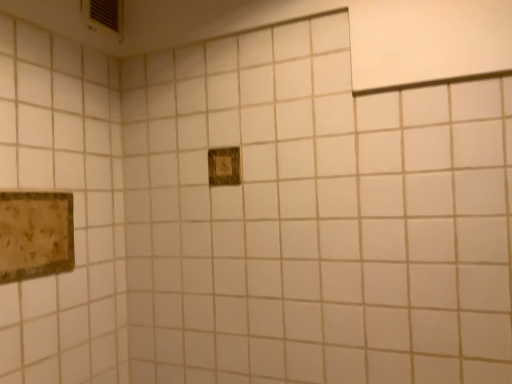
Measure the distance between point [27,258] and camera.

Point [27,258] is 1.01 meters away from camera.

Identify the location of rustic wood picture frame at lower left, which is the 1th picture frame in front-to-back order. (35, 235).

This screenshot has width=512, height=384. Describe the element at coordinates (35, 235) in the screenshot. I see `rustic wood picture frame at lower left, the second picture frame from the top` at that location.

This screenshot has width=512, height=384. Describe the element at coordinates (224, 166) in the screenshot. I see `wooden plaque at center, the second picture frame when ordered from bottom to top` at that location.

The width and height of the screenshot is (512, 384). I want to click on wooden plaque at center, the second picture frame when ordered from bottom to top, so click(224, 166).

Find the location of a particular element. The width and height of the screenshot is (512, 384). rustic wood picture frame at lower left, the second picture frame from the top is located at coordinates click(x=35, y=235).

Can you confirm if wooden plaque at center, the first picture frame when ordered from top to bottom, is positioned to the left of rustic wood picture frame at lower left, which is the 2th picture frame in right-to-left order?

No, wooden plaque at center, the first picture frame when ordered from top to bottom, is not to the left of rustic wood picture frame at lower left, which is the 2th picture frame in right-to-left order.

Is the depth of wooden plaque at center, placed as the 2th picture frame when sorted from front to back, greater than that of rustic wood picture frame at lower left, the second picture frame from the top?

Yes.

Which point is more distant from viewer, (228, 154) or (57, 199)?

The point (228, 154) is more distant.

From the image's perspective, is wooden plaque at center, which is the 1th picture frame from back to front, over rustic wood picture frame at lower left, the second picture frame from the top?

Yes.

From a real-world perspective, is wooden plaque at center, which is the first picture frame from right to left, under rustic wood picture frame at lower left, which is the 1th picture frame in front-to-back order?

Incorrect, from a real-world perspective, wooden plaque at center, which is the first picture frame from right to left, is higher than rustic wood picture frame at lower left, which is the 1th picture frame in front-to-back order.

Which object is thinner, wooden plaque at center, which is the 1th picture frame from back to front, or rustic wood picture frame at lower left, which appears as the first picture frame when ordered from the bottom?

Thinner between the two is wooden plaque at center, which is the 1th picture frame from back to front.

Is wooden plaque at center, which is the 1th picture frame from back to front, taller than rustic wood picture frame at lower left, acting as the second picture frame starting from the back?

No.

Who is bigger, wooden plaque at center, which appears as the second picture frame when viewed from the left, or rustic wood picture frame at lower left, acting as the second picture frame starting from the back?

rustic wood picture frame at lower left, acting as the second picture frame starting from the back, is bigger.

Can rustic wood picture frame at lower left, acting as the second picture frame starting from the back, be found inside wooden plaque at center, which is the 1th picture frame from back to front?

No, rustic wood picture frame at lower left, acting as the second picture frame starting from the back, is located outside of wooden plaque at center, which is the 1th picture frame from back to front.

Is wooden plaque at center, which is the 1th picture frame from back to front, not near rustic wood picture frame at lower left, which appears as the first picture frame when ordered from the bottom?

No, wooden plaque at center, which is the 1th picture frame from back to front, is not far from rustic wood picture frame at lower left, which appears as the first picture frame when ordered from the bottom.

Is wooden plaque at center, the second picture frame when ordered from bottom to top, looking in the opposite direction of rustic wood picture frame at lower left, which appears as the first picture frame when ordered from the bottom?

wooden plaque at center, the second picture frame when ordered from bottom to top, does not have its back to rustic wood picture frame at lower left, which appears as the first picture frame when ordered from the bottom.

I want to click on picture frame to the right of rustic wood picture frame at lower left, which appears as the first picture frame when ordered from the bottom, so click(x=224, y=166).

Consider the image. Can you confirm if rustic wood picture frame at lower left, which is the 1th picture frame in front-to-back order, is positioned to the right of wooden plaque at center, the first picture frame when ordered from top to bottom?

No, rustic wood picture frame at lower left, which is the 1th picture frame in front-to-back order, is not to the right of wooden plaque at center, the first picture frame when ordered from top to bottom.

Considering their positions, is rustic wood picture frame at lower left, which is the 2th picture frame in right-to-left order, located in front of or behind wooden plaque at center, the second picture frame when ordered from bottom to top?

Clearly, rustic wood picture frame at lower left, which is the 2th picture frame in right-to-left order, is in front of wooden plaque at center, the second picture frame when ordered from bottom to top.

Which is nearer, (28,205) or (237,163)?

Point (28,205) appears to be closer to the viewer than point (237,163).

In the scene shown: From the image's perspective, is rustic wood picture frame at lower left, which is the 2th picture frame in right-to-left order, under wooden plaque at center, the first picture frame when ordered from top to bottom?

Indeed, from the image's perspective, rustic wood picture frame at lower left, which is the 2th picture frame in right-to-left order, is shown beneath wooden plaque at center, the first picture frame when ordered from top to bottom.

Looking at this image, from a real-world perspective, is rustic wood picture frame at lower left, the second picture frame from the top, above or below wooden plaque at center, placed as the 2th picture frame when sorted from front to back?

rustic wood picture frame at lower left, the second picture frame from the top, is below wooden plaque at center, placed as the 2th picture frame when sorted from front to back.

Consider the image. Is rustic wood picture frame at lower left, the second picture frame from the top, wider than wooden plaque at center, the first picture frame when ordered from top to bottom?

Indeed, rustic wood picture frame at lower left, the second picture frame from the top, has a greater width compared to wooden plaque at center, the first picture frame when ordered from top to bottom.

Considering the relative sizes of rustic wood picture frame at lower left, which appears as the first picture frame when ordered from the bottom, and wooden plaque at center, placed as the 2th picture frame when sorted from front to back, in the image provided, is rustic wood picture frame at lower left, which appears as the first picture frame when ordered from the bottom, shorter than wooden plaque at center, placed as the 2th picture frame when sorted from front to back,?

In fact, rustic wood picture frame at lower left, which appears as the first picture frame when ordered from the bottom, may be taller than wooden plaque at center, placed as the 2th picture frame when sorted from front to back.

Based on the photo, is rustic wood picture frame at lower left, which is the 2th picture frame in right-to-left order, smaller than wooden plaque at center, placed as the 2th picture frame when sorted from front to back?

Incorrect, rustic wood picture frame at lower left, which is the 2th picture frame in right-to-left order, is not smaller in size than wooden plaque at center, placed as the 2th picture frame when sorted from front to back.

Is rustic wood picture frame at lower left, which is the 2th picture frame in right-to-left order, not inside wooden plaque at center, which is the first picture frame from right to left?

Yes, rustic wood picture frame at lower left, which is the 2th picture frame in right-to-left order, is outside of wooden plaque at center, which is the first picture frame from right to left.

Is rustic wood picture frame at lower left, which is the 1th picture frame in front-to-back order, far from wooden plaque at center, which is the 1th picture frame from back to front?

No, there isn't a large distance between rustic wood picture frame at lower left, which is the 1th picture frame in front-to-back order, and wooden plaque at center, which is the 1th picture frame from back to front.

Is rustic wood picture frame at lower left, the second picture frame from the top, facing away from wooden plaque at center, placed as the 2th picture frame when sorted from front to back?

That's not correct — rustic wood picture frame at lower left, the second picture frame from the top, is not looking away from wooden plaque at center, placed as the 2th picture frame when sorted from front to back.

Measure the distance between rustic wood picture frame at lower left, marked as the first picture frame in a left-to-right arrangement, and wooden plaque at center, which appears as the second picture frame when viewed from the left.

rustic wood picture frame at lower left, marked as the first picture frame in a left-to-right arrangement, and wooden plaque at center, which appears as the second picture frame when viewed from the left, are 46.14 centimeters apart.

Locate an element on the screen. picture frame located above the rustic wood picture frame at lower left, which appears as the first picture frame when ordered from the bottom (from the image's perspective) is located at coordinates (224, 166).

In the image, there is a rustic wood picture frame at lower left, which is the 2th picture frame in right-to-left order. Where is `picture frame above it (from the image's perspective)`? picture frame above it (from the image's perspective) is located at coordinates (224, 166).

At what (x,y) coordinates should I click in order to perform the action: click on picture frame behind the rustic wood picture frame at lower left, marked as the first picture frame in a left-to-right arrangement. Please return your answer as a coordinate pair (x, y). Looking at the image, I should click on (224, 166).